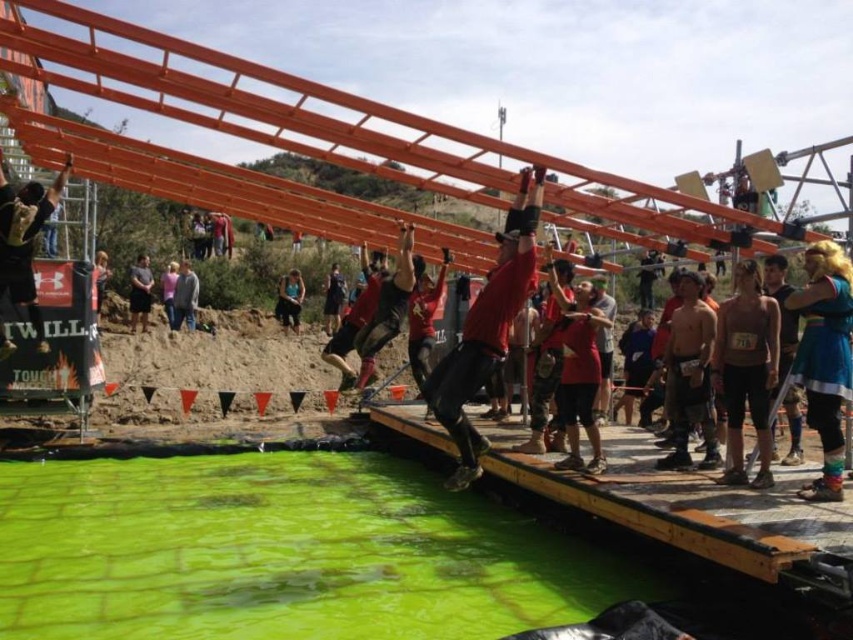
You are a participant in the obstacle course and need to locate your teammate wearing the blue fabric shirt at center. From your position at the start line, which direction should you look to find them relative to the black fabric at center?

The blue fabric shirt at center is to the left of the black fabric at center, so you should look to the left side of the black fabric at center to find your teammate.

You are a participant in the obstacle course and need to reach the finish line marked by the point at (726, 371). There is a checkpoint at point (445, 593) that you must pass before proceeding. Will you reach the checkpoint before reaching the finish line?

Yes, because point (445, 593) is closer to the viewer than point (726, 371), so you will reach the checkpoint first before proceeding to the finish line.